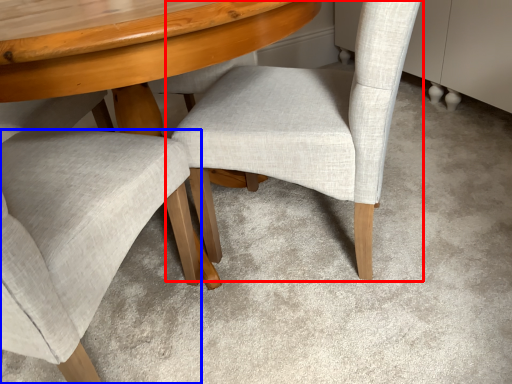
Question: Among these objects, which one is nearest to the camera, chair (highlighted by a red box) or chair (highlighted by a blue box)?

Choices:
 (A) chair
 (B) chair

Answer: (B)